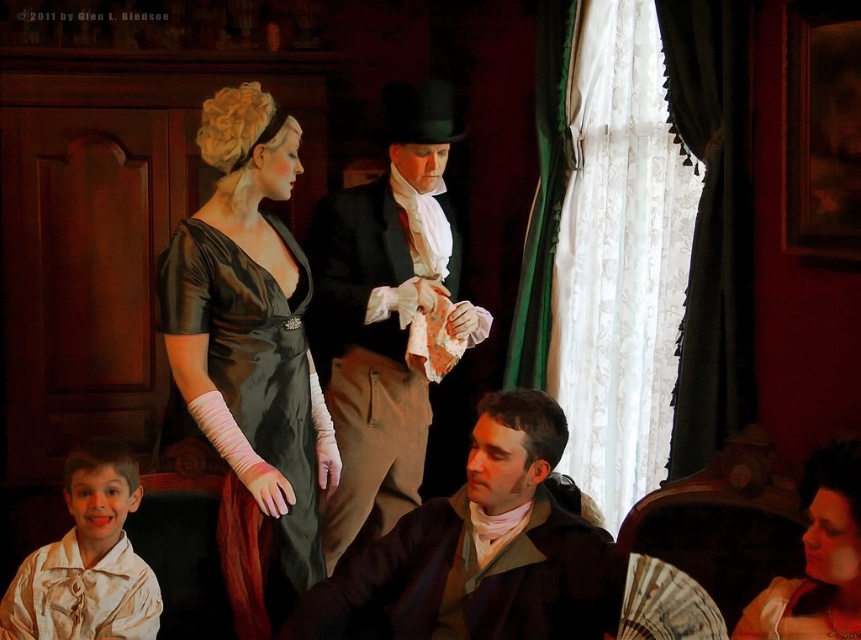
Question: Can you confirm if satin dress at upper left is smaller than velvet red dress at center?

Choices:
 (A) yes
 (B) no

Answer: (B)

Question: Which of the following is the farthest from the observer?

Choices:
 (A) smooth black suit at center
 (B) white satin shirt at lower left
 (C) matte brown coat at center
 (D) satin dress at upper left

Answer: (A)

Question: Can you confirm if satin dress at upper left is positioned to the right of white satin shirt at lower left?

Choices:
 (A) yes
 (B) no

Answer: (A)

Question: Does white satin shirt at lower left lie behind velvet red dress at center?

Choices:
 (A) no
 (B) yes

Answer: (B)

Question: Which of these objects is positioned closest to the white satin shirt at lower left?

Choices:
 (A) smooth black suit at center
 (B) satin dress at upper left
 (C) matte brown coat at center
 (D) smooth cream-colored dress at center

Answer: (B)

Question: Among these points, which one is nearest to the camera?

Choices:
 (A) (101, 488)
 (B) (815, 474)
 (C) (443, 236)

Answer: (B)